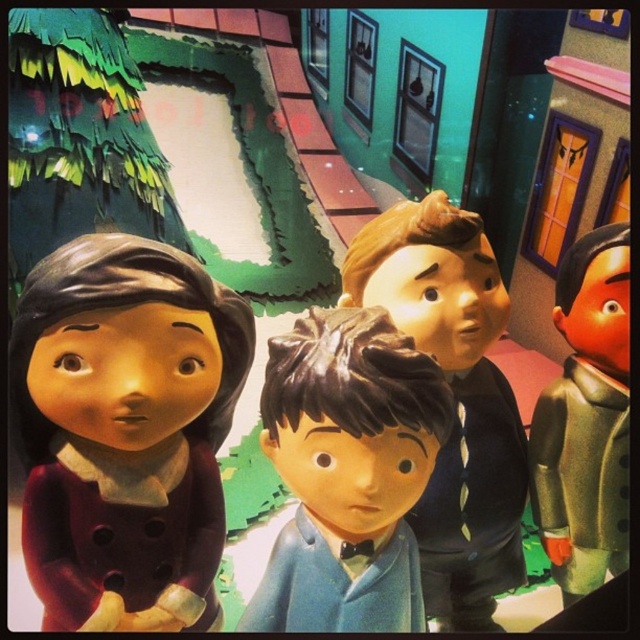
You are a visitor in this hallway and want to greet both the matte brown doll at left and the satin blue suit at center. If you start from the entrance, which figure should you approach first?

The matte brown doll at left is to the left of the satin blue suit at center, so you should approach the matte brown doll at left first since it is positioned closer to your left side when entering the hallway.

You are a photographer setting up a photo shoot in the hallway. You need to arrange the two figurines, the satin blue suit at center and the green matte suit at right, so that they appear to be the same height in the photo. Considering their actual heights, which one should you place closer to the camera?

The satin blue suit at center is shorter than the green matte suit at right. To make them appear the same height in the photo, place the shorter satin blue suit at center closer to the camera and the taller green matte suit at right further back.